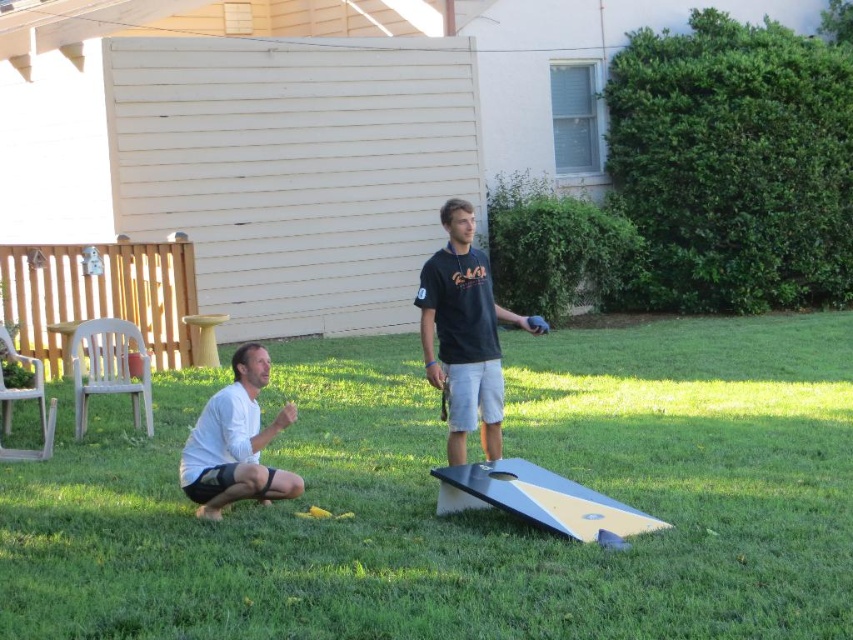
Question: Which is nearer to the white matte shorts at lower left?

Choices:
 (A) black matte shirt at center
 (B) green grass at center

Answer: (A)

Question: Is green grass at center smaller than black matte shirt at center?

Choices:
 (A) no
 (B) yes

Answer: (A)

Question: Which point is farther to the camera?

Choices:
 (A) white matte shorts at lower left
 (B) green grass at center
 (C) black matte shirt at center

Answer: (C)

Question: Which point is closer to the camera taking this photo?

Choices:
 (A) 473,289
 (B) 824,532
 (C) 216,468

Answer: (B)

Question: Is green grass at center below white matte shorts at lower left?

Choices:
 (A) yes
 (B) no

Answer: (A)

Question: Is green grass at center in front of white matte shorts at lower left?

Choices:
 (A) yes
 (B) no

Answer: (A)